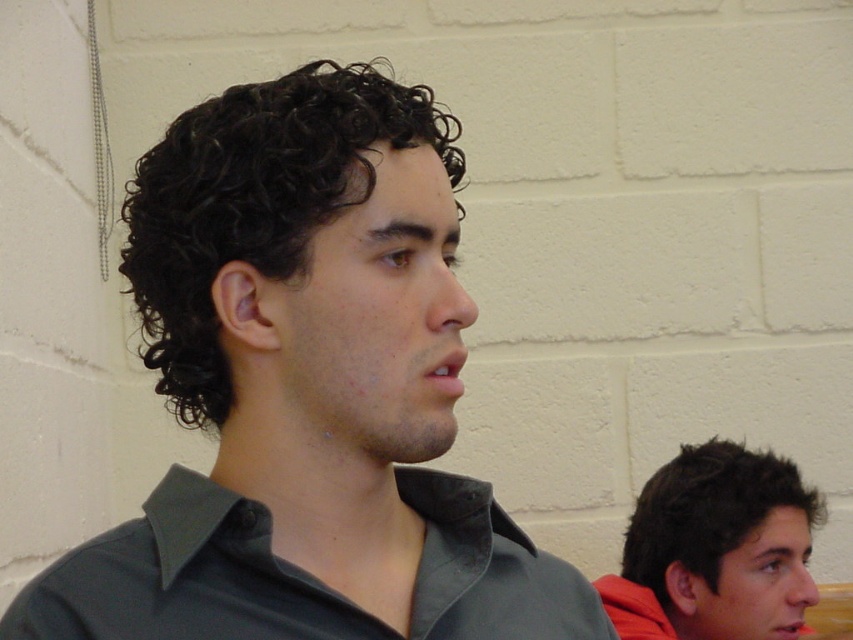
You are standing in the gymnasium and see a point marked at coordinates (306,388). Based on the scene description, which object is this point located on?

The point at (306,388) is located on the dark green shirt at center.

You are standing in a gymnasium and see the dark gray cotton shirt at center. If you want to reach it without moving your feet, is it within arm reach?

The dark gray cotton shirt at center is 35.20 inches away from the viewer. Since the average human arm span is about 30 inches, you cannot reach it without moving your feet.

You are a photographer setting up for a group photo. You notice two shirts in the center of the frame, a dark green shirt at center and a dark gray cotton shirt at center. Which shirt should you adjust to ensure both shirts are equally visible in the photo?

The dark green shirt at center is much taller than the dark gray cotton shirt at center, so you should lower the dark green shirt at center to match the height of the dark gray cotton shirt at center for equal visibility.